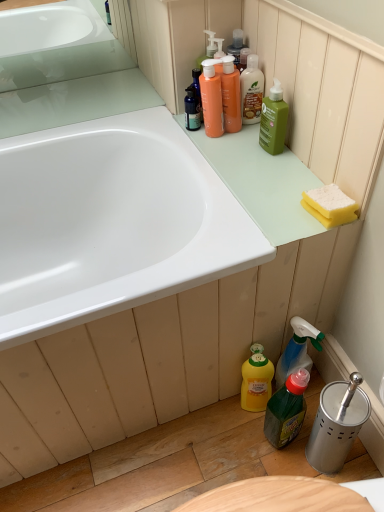
Find the location of `space that is in front of translucent plastic bottle at upper center, which appears as the first cleaning product when viewed from the top`. space that is in front of translucent plastic bottle at upper center, which appears as the first cleaning product when viewed from the top is located at coordinates (246, 152).